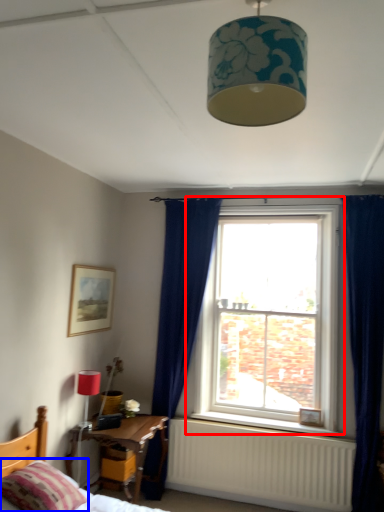
Question: Which object appears farthest to the camera in this image, window (highlighted by a red box) or pillow (highlighted by a blue box)?

Choices:
 (A) window
 (B) pillow

Answer: (A)